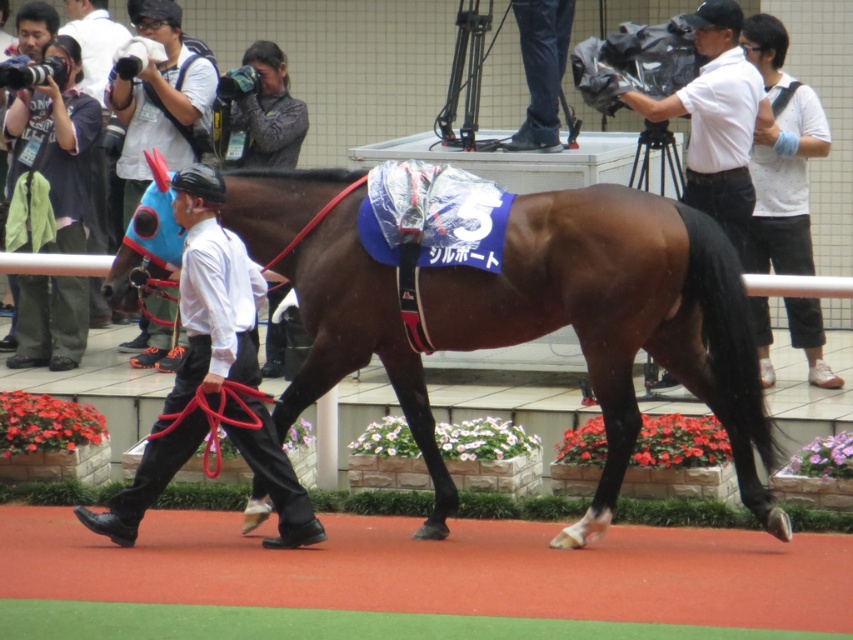
Does white smooth shirt at upper right appear over blue fabric helmet at left?

Actually, white smooth shirt at upper right is below blue fabric helmet at left.

Does white smooth shirt at upper right come in front of blue fabric helmet at left?

Yes.

Locate an element on the screen. The width and height of the screenshot is (853, 640). white smooth shirt at upper right is located at coordinates (717, 118).

Is point (212, 381) closer to camera compared to point (763, 58)?

Yes, it is in front of point (763, 58).

Which of these two, white shirt at center or white dotted shirt at upper right, stands taller?

white shirt at center

This screenshot has height=640, width=853. What do you see at coordinates (212, 292) in the screenshot?
I see `white shirt at center` at bounding box center [212, 292].

Where is `white shirt at center`? white shirt at center is located at coordinates (212, 292).

Can you confirm if brown glossy horse at center is positioned to the left of blue fabric helmet at left?

No, brown glossy horse at center is not to the left of blue fabric helmet at left.

Who is higher up, brown glossy horse at center or blue fabric helmet at left?

Positioned higher is blue fabric helmet at left.

Locate an element on the screen. Image resolution: width=853 pixels, height=640 pixels. brown glossy horse at center is located at coordinates (618, 320).